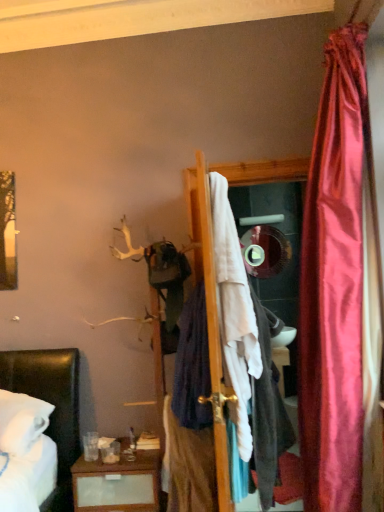
Question: From the image's perspective, is dark blue fabric at center, which ranks as the 1th clothing in left-to-right order, below white fabric at center, the 3th clothing positioned from the left?

Choices:
 (A) yes
 (B) no

Answer: (A)

Question: Considering the relative sizes of dark blue fabric at center, which appears as the third clothing when viewed from the right, and white fabric at center, the 3th clothing positioned from the left, in the image provided, is dark blue fabric at center, which appears as the third clothing when viewed from the right, taller than white fabric at center, the 3th clothing positioned from the left,?

Choices:
 (A) yes
 (B) no

Answer: (B)

Question: Is the depth of dark blue fabric at center, which appears as the third clothing when viewed from the right, less than that of white fabric at center, the 3th clothing positioned from the left?

Choices:
 (A) no
 (B) yes

Answer: (A)

Question: Is dark blue fabric at center, which appears as the third clothing when viewed from the right, thinner than white fabric at center, marked as the 1th clothing in a right-to-left arrangement?

Choices:
 (A) yes
 (B) no

Answer: (A)

Question: Does dark blue fabric at center, which ranks as the 1th clothing in left-to-right order, turn towards white fabric at center, the 3th clothing positioned from the left?

Choices:
 (A) yes
 (B) no

Answer: (B)

Question: Considering the positions of dark blue fabric at center, the 2th clothing positioned from the right, and dark blue fabric at center, which appears as the third clothing when viewed from the right, in the image, is dark blue fabric at center, the 2th clothing positioned from the right, bigger or smaller than dark blue fabric at center, which appears as the third clothing when viewed from the right,?

Choices:
 (A) big
 (B) small

Answer: (A)

Question: Is point (178, 361) positioned closer to the camera than point (210, 477)?

Choices:
 (A) closer
 (B) farther

Answer: (B)

Question: Is dark blue fabric at center, which is the second clothing from left to right, inside the boundaries of dark blue fabric at center, which ranks as the 1th clothing in left-to-right order, or outside?

Choices:
 (A) outside
 (B) inside

Answer: (A)

Question: Based on their positions, is dark blue fabric at center, which is the second clothing from left to right, located to the left or right of dark blue fabric at center, which appears as the third clothing when viewed from the right?

Choices:
 (A) right
 (B) left

Answer: (A)

Question: Does point (271, 467) appear closer or farther from the camera than point (261, 272)?

Choices:
 (A) closer
 (B) farther

Answer: (A)

Question: In terms of size, does white fabric at center, the 3th clothing positioned from the left, appear bigger or smaller than shiny silver mirror at center?

Choices:
 (A) small
 (B) big

Answer: (B)

Question: Is white fabric at center, marked as the 1th clothing in a right-to-left arrangement, taller or shorter than shiny silver mirror at center?

Choices:
 (A) short
 (B) tall

Answer: (B)

Question: From a real-world perspective, relative to shiny silver mirror at center, is white fabric at center, the 3th clothing positioned from the left, vertically above or below?

Choices:
 (A) below
 (B) above

Answer: (A)

Question: Would you say dark blue fabric at center, the 2th clothing positioned from the right, is to the left or to the right of white fabric at center, the 3th clothing positioned from the left, in the picture?

Choices:
 (A) right
 (B) left

Answer: (B)

Question: From a real-world perspective, is dark blue fabric at center, which is the second clothing from left to right, above or below white fabric at center, the 3th clothing positioned from the left?

Choices:
 (A) above
 (B) below

Answer: (A)